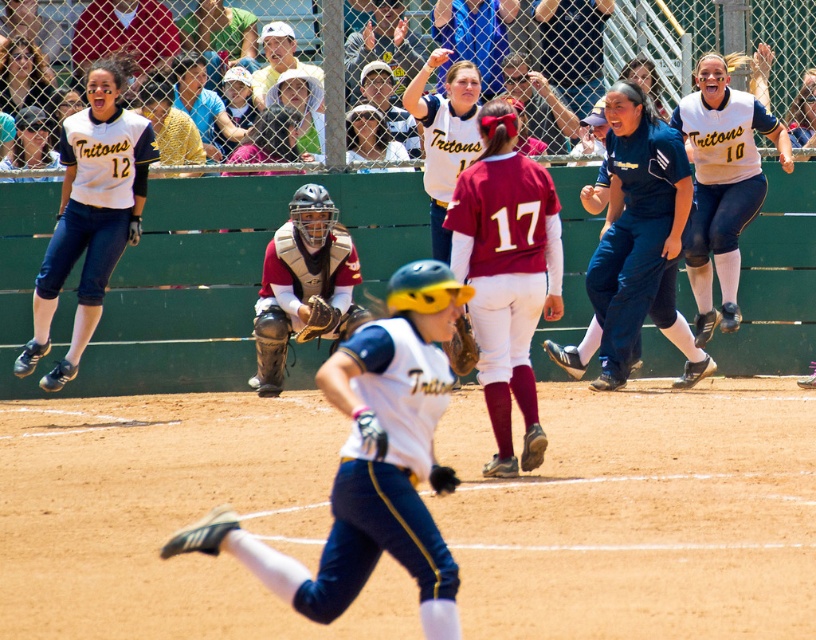
Can you confirm if maroon leather catcher at center is thinner than matte black hair at upper left?

No.

Which is behind, point (353, 275) or point (30, 92)?

The point (30, 92) is behind.

Who is more distant from viewer, (260, 330) or (11, 100)?

The point (11, 100) is more distant.

The height and width of the screenshot is (640, 816). I want to click on maroon leather catcher at center, so click(304, 284).

Who is more distant from viewer, [429,259] or [458,324]?

The point [429,259] is more distant.

Find the location of a particular element. white matte uniform at center is located at coordinates (371, 461).

What do you see at coordinates (371, 461) in the screenshot? I see `white matte uniform at center` at bounding box center [371, 461].

You are a GUI agent. You are given a task and a screenshot of the screen. Output one action in this format:
    pyautogui.click(x=<x>, y=<y>)
    Task: Click on the white matte uniform at center
    The height and width of the screenshot is (640, 816).
    Given the screenshot: What is the action you would take?
    pyautogui.click(x=371, y=461)

Locate an element on the screen. This screenshot has height=640, width=816. brown leather baseball glove at center is located at coordinates (460, 348).

Is point (460, 353) less distant than point (316, 324)?

Yes, point (460, 353) is in front of point (316, 324).

Where is `brown leather baseball glove at center`? The image size is (816, 640). brown leather baseball glove at center is located at coordinates (460, 348).